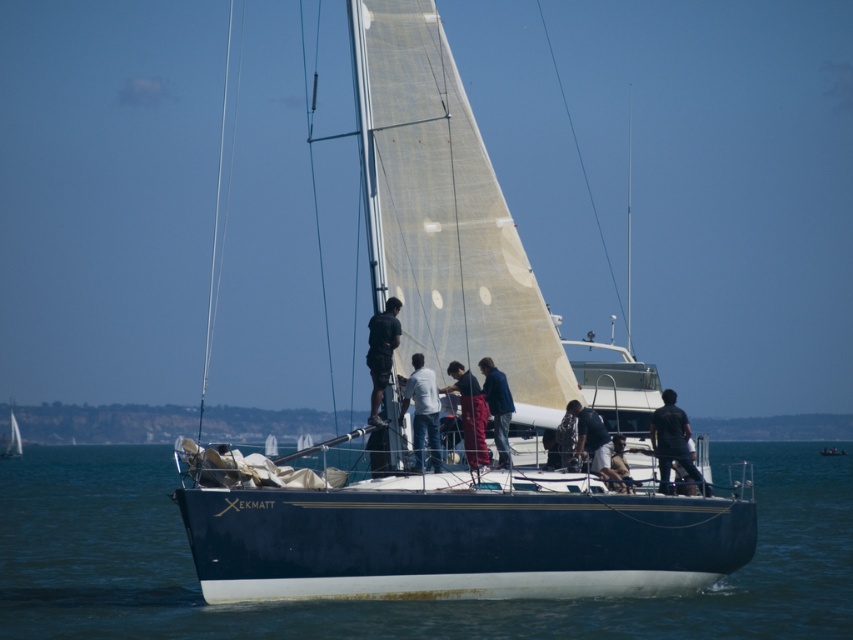
Question: Which of the following is the farthest from the observer?

Choices:
 (A) blue fabric jacket at center
 (B) white sail at center
 (C) blue water at center
 (D) black matte shorts at center

Answer: (B)

Question: Among these points, which one is nearest to the camera?

Choices:
 (A) (431, 426)
 (B) (664, 444)

Answer: (A)

Question: Is black matte shirt at right behind black matte shorts at center?

Choices:
 (A) yes
 (B) no

Answer: (A)

Question: Which of the following is the farthest from the observer?

Choices:
 (A) (12, 424)
 (B) (502, 460)
 (C) (126, 504)
 (D) (709, 488)

Answer: (A)

Question: Is blue water at center above white sail at center?

Choices:
 (A) yes
 (B) no

Answer: (A)

Question: Does blue water at center have a smaller size compared to white cotton shirt at center?

Choices:
 (A) yes
 (B) no

Answer: (B)